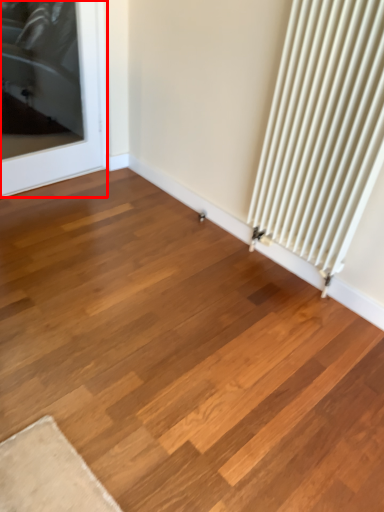
Question: From the image's perspective, considering the relative positions of door (annotated by the red box) and radiator in the image provided, where is door (annotated by the red box) located with respect to the staircase?

Choices:
 (A) above
 (B) below

Answer: (A)